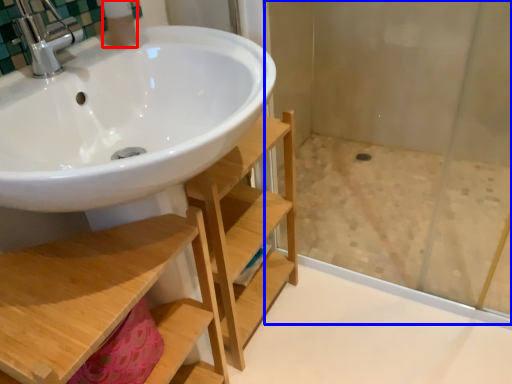
Question: Which of the following is the farthest to the observer, toiletry (highlighted by a red box) or shower door (highlighted by a blue box)?

Choices:
 (A) toiletry
 (B) shower door

Answer: (B)